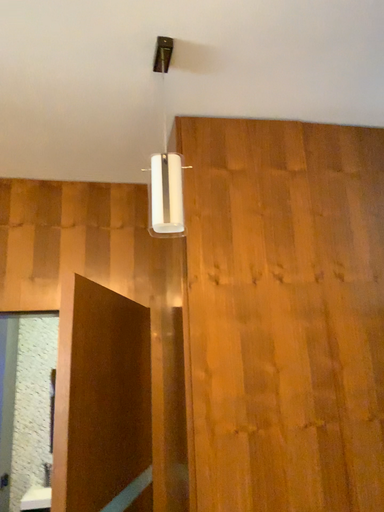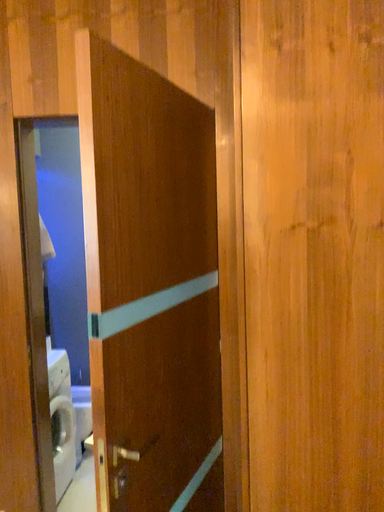
Question: How did the camera likely rotate when shooting the video?

Choices:
 (A) rotated right
 (B) rotated left

Answer: (B)